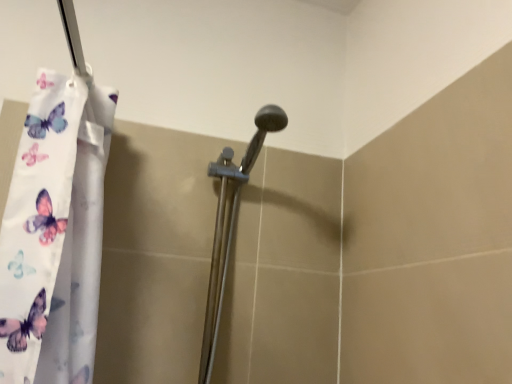
Locate an element on the screen. The image size is (512, 384). satin silver shower head at center is located at coordinates (230, 225).

This screenshot has width=512, height=384. What do you see at coordinates (230, 225) in the screenshot?
I see `satin silver shower head at center` at bounding box center [230, 225].

What are the coordinates of `satin silver shower head at center` in the screenshot? It's located at (230, 225).